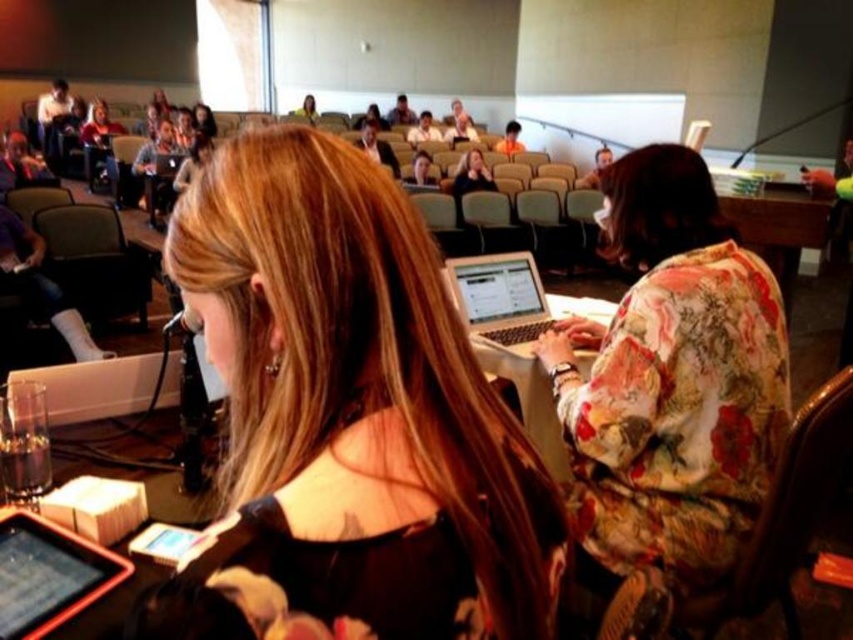
You are an event organizer who needs to ensure that the front row has enough space for both the shiny black hair at center and the silver metallic laptop at center. Based on the scene, which object takes up more horizontal space?

The shiny black hair at center takes up more horizontal space than the silver metallic laptop at center because its width is larger according to the description.

You are standing in the conference room and want to reach a specific point marked at coordinates point [289,420]. If your arm can reach up to 20 inches, can you touch that point without moving your feet?

The distance of point [289,420] from camera is 21.24 inches. Since your arm can only reach up to 20 inches, you cannot touch the point without moving your feet.

From the picture: You are an event organizer standing at the back of the conference room. You need to hand out a document to both the floral silk blouse at center and the white glossy shirt at center. Which one is closer to you?

The floral silk blouse at center is 8.16 meters away from the white glossy shirt at center. Since you are at the back of the conference room, the distance between them doesn